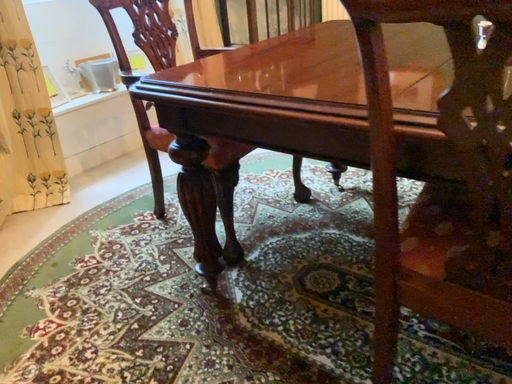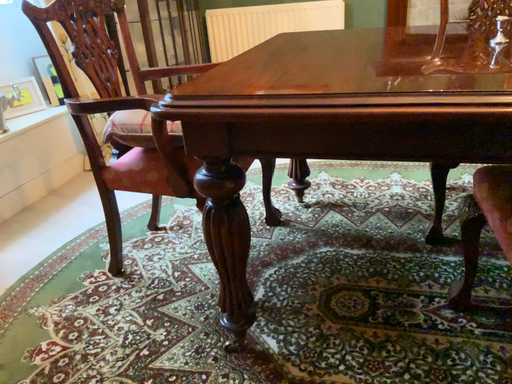
Question: How did the camera likely rotate when shooting the video?

Choices:
 (A) rotated left
 (B) rotated right

Answer: (B)